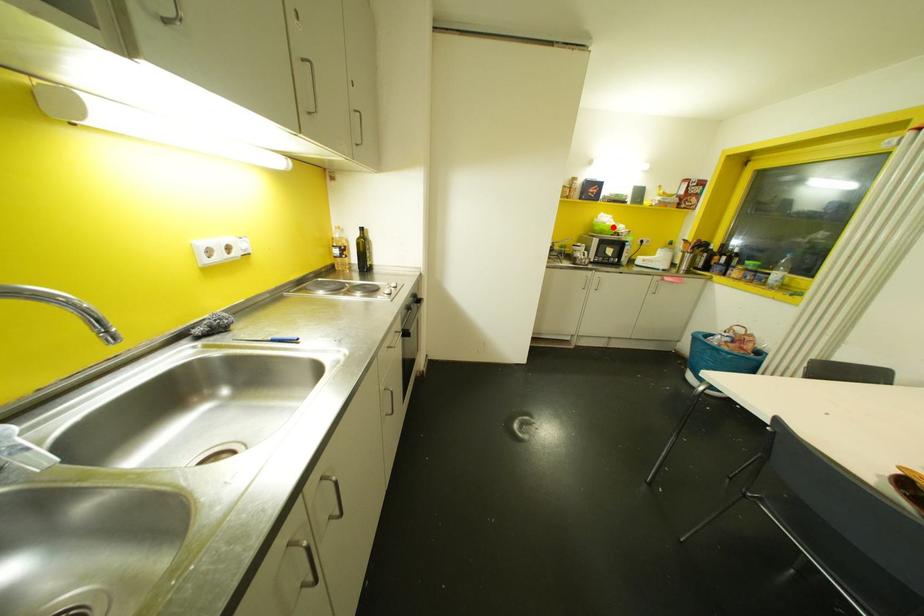
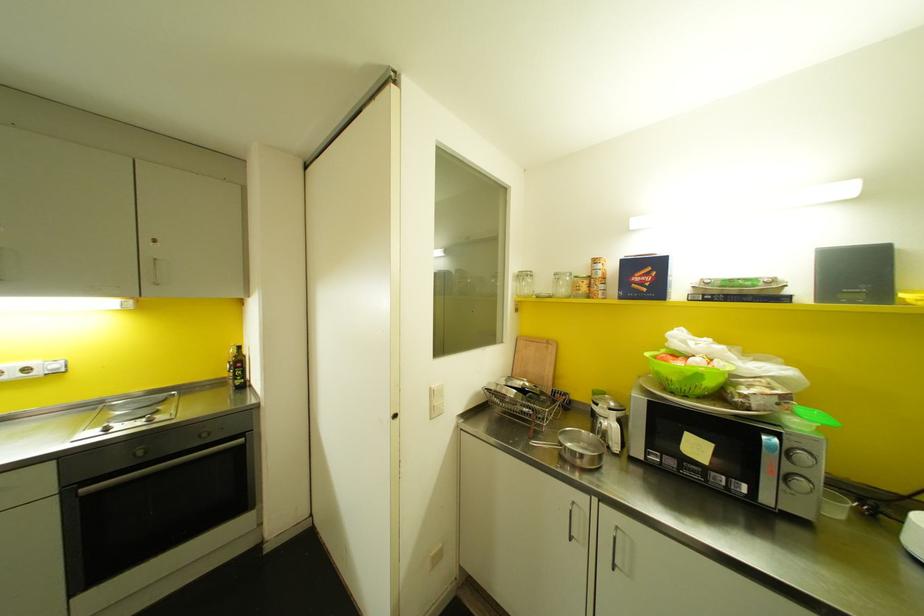
Question: I am providing you with two images of the same scene from different viewpoints. Given a red point in image1, look at the same physical point in image2. Is it:

Choices:
 (A) Closer to the viewpoint
 (B) Farther from the viewpoint

Answer: (B)